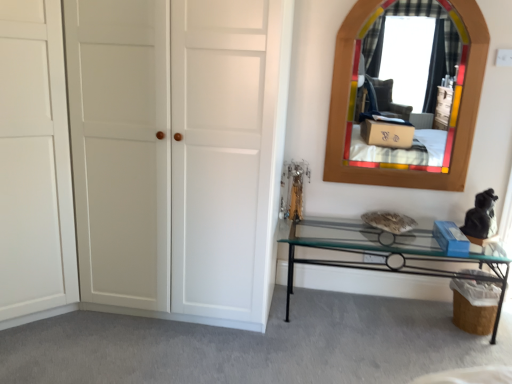
Question: Should I look upward or downward to see wooden stained mirror at upper right?

Choices:
 (A) up
 (B) down

Answer: (A)

Question: Is white matte door at left, the first door viewed from the right, to the right of wooden stained mirror at upper right from the viewer's perspective?

Choices:
 (A) no
 (B) yes

Answer: (A)

Question: From the image's perspective, is white matte door at left, the first door viewed from the right, under wooden stained mirror at upper right?

Choices:
 (A) no
 (B) yes

Answer: (B)

Question: Is white matte door at left, the first door viewed from the right, closer to the viewer compared to wooden stained mirror at upper right?

Choices:
 (A) yes
 (B) no

Answer: (A)

Question: Does white matte door at left, which is counted as the 2th door, starting from the left, have a smaller size compared to wooden stained mirror at upper right?

Choices:
 (A) no
 (B) yes

Answer: (A)

Question: Are white matte door at left, which is counted as the 2th door, starting from the left, and wooden stained mirror at upper right far apart?

Choices:
 (A) no
 (B) yes

Answer: (B)

Question: Is white matte door at left, the first door viewed from the right, positioned behind wooden stained mirror at upper right?

Choices:
 (A) yes
 (B) no

Answer: (B)

Question: From a real-world perspective, is clear glass table at lower right under wooden stained mirror at upper right?

Choices:
 (A) no
 (B) yes

Answer: (B)

Question: Is clear glass table at lower right located outside wooden stained mirror at upper right?

Choices:
 (A) no
 (B) yes

Answer: (B)

Question: Is clear glass table at lower right closer to camera compared to wooden stained mirror at upper right?

Choices:
 (A) no
 (B) yes

Answer: (B)

Question: Considering the relative positions of clear glass table at lower right and wooden stained mirror at upper right in the image provided, is clear glass table at lower right to the left of wooden stained mirror at upper right from the viewer's perspective?

Choices:
 (A) yes
 (B) no

Answer: (A)

Question: Can you confirm if clear glass table at lower right is thinner than wooden stained mirror at upper right?

Choices:
 (A) no
 (B) yes

Answer: (A)

Question: Does clear glass table at lower right have a lesser height compared to wooden stained mirror at upper right?

Choices:
 (A) no
 (B) yes

Answer: (B)

Question: From the image's perspective, does wooden stained mirror at upper right appear lower than white matte door at left, the second door viewed from the right?

Choices:
 (A) no
 (B) yes

Answer: (A)